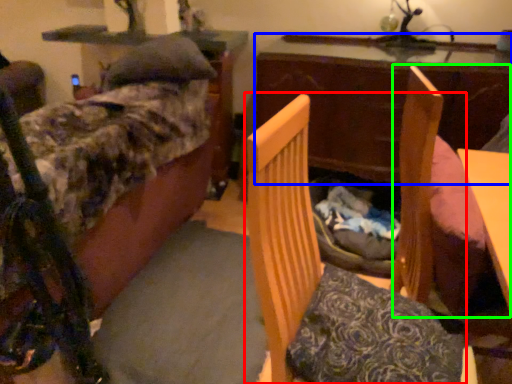
Question: Which object is the closest to the furniture (highlighted by a red box)? Choose among these: table (highlighted by a blue box) or swivel chair (highlighted by a green box).

Choices:
 (A) table
 (B) swivel chair

Answer: (B)